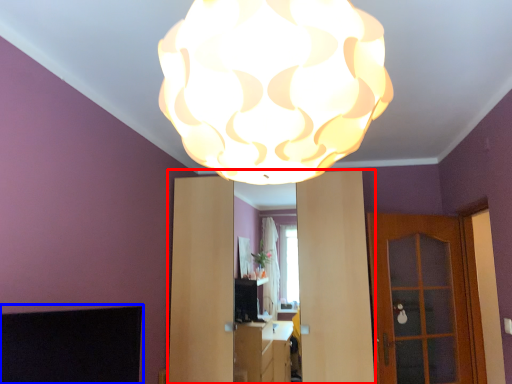
Question: Among these objects, which one is farthest to the camera, dresser (highlighted by a red box) or fireplace (highlighted by a blue box)?

Choices:
 (A) dresser
 (B) fireplace

Answer: (A)